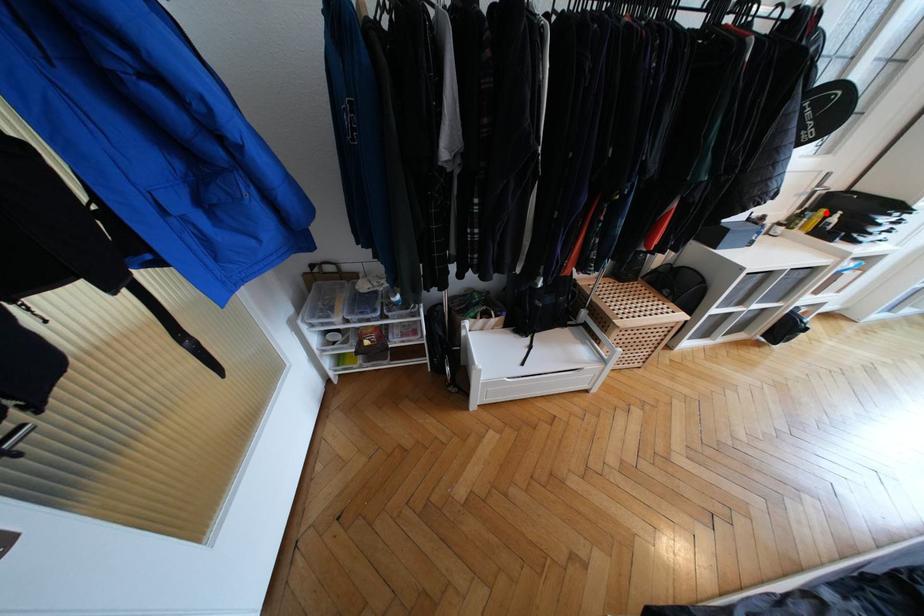
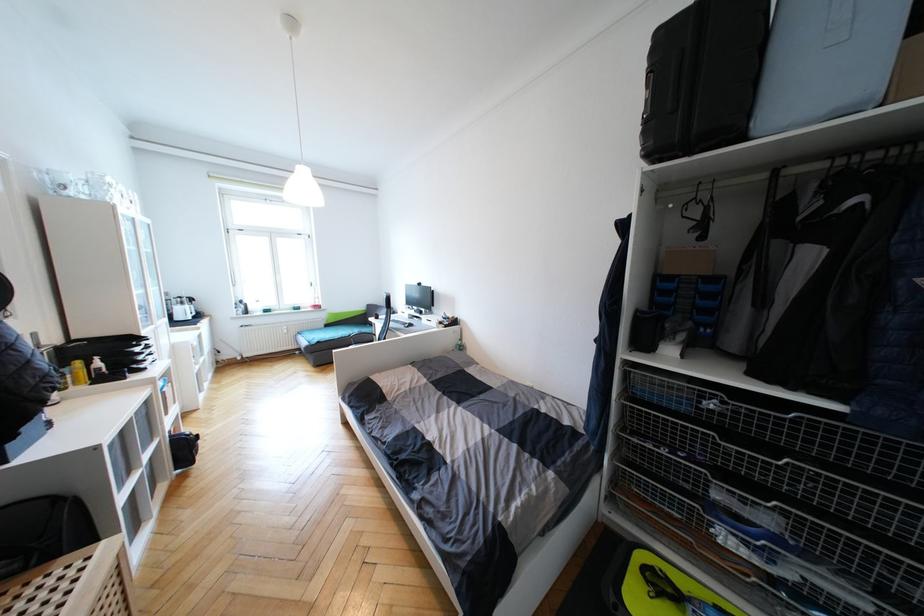
Question: A red point is marked in image1. In image2, is the corresponding 3D point closer to the camera or farther? Reply with the corresponding letter.

Choices:
 (A) The corresponding 3D point is closer.
 (B) The corresponding 3D point is farther.

Answer: (B)